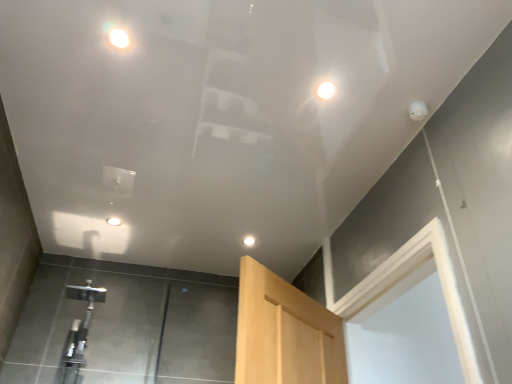
Question: Is matte white droplight at upper center, the 4th droplight positioned from the back, further to the viewer compared to white glossy droplight at upper center, the fourth droplight viewed from the right?

Choices:
 (A) no
 (B) yes

Answer: (A)

Question: Does matte white droplight at upper center, arranged as the 3th droplight when viewed from the right, lie in front of white glossy droplight at upper center, the fourth droplight viewed from the right?

Choices:
 (A) no
 (B) yes

Answer: (B)

Question: Is matte white droplight at upper center, arranged as the first droplight when viewed from the front, not close to white glossy droplight at upper center, which appears as the 2th droplight when viewed from the back?

Choices:
 (A) no
 (B) yes

Answer: (B)

Question: Is matte white droplight at upper center, acting as the second droplight starting from the left, wider than white glossy droplight at upper center, which is the third droplight from front to back?

Choices:
 (A) yes
 (B) no

Answer: (B)

Question: Considering the relative sizes of matte white droplight at upper center, acting as the second droplight starting from the left, and white glossy droplight at upper center, the fourth droplight viewed from the right, in the image provided, is matte white droplight at upper center, acting as the second droplight starting from the left, shorter than white glossy droplight at upper center, the fourth droplight viewed from the right,?

Choices:
 (A) no
 (B) yes

Answer: (A)

Question: In the image, is matte white droplight at upper center, acting as the second droplight starting from the left, positioned in front of or behind white glossy droplight at upper center, arranged as the 1th droplight when viewed from the back?

Choices:
 (A) front
 (B) behind

Answer: (A)

Question: In terms of width, does matte white droplight at upper center, acting as the second droplight starting from the left, look wider or thinner when compared to white glossy droplight at upper center, which is counted as the second droplight, starting from the right?

Choices:
 (A) thin
 (B) wide

Answer: (B)

Question: From a real-world perspective, is matte white droplight at upper center, acting as the second droplight starting from the left, above or below white glossy droplight at upper center, which is the 4th droplight in front-to-back order?

Choices:
 (A) above
 (B) below

Answer: (A)

Question: Would you say matte white droplight at upper center, acting as the second droplight starting from the left, is to the left or to the right of white glossy droplight at upper center, which is the 4th droplight in front-to-back order, in the picture?

Choices:
 (A) left
 (B) right

Answer: (A)

Question: Considering the positions of point [x=114, y=41] and point [x=321, y=89], is point [x=114, y=41] closer or farther from the camera than point [x=321, y=89]?

Choices:
 (A) farther
 (B) closer

Answer: (B)

Question: From the image's perspective, relative to white glossy droplight at upper center, placed as the second droplight when sorted from front to back, is matte white droplight at upper center, acting as the second droplight starting from the left, above or below?

Choices:
 (A) above
 (B) below

Answer: (A)

Question: In the image, is matte white droplight at upper center, acting as the second droplight starting from the left, on the left side or the right side of white glossy droplight at upper center, the first droplight when ordered from right to left?

Choices:
 (A) right
 (B) left

Answer: (B)

Question: Considering the positions of matte white droplight at upper center, the 4th droplight positioned from the back, and white glossy droplight at upper center, the first droplight when ordered from right to left, in the image, is matte white droplight at upper center, the 4th droplight positioned from the back, wider or thinner than white glossy droplight at upper center, the first droplight when ordered from right to left,?

Choices:
 (A) thin
 (B) wide

Answer: (A)

Question: Is white glossy droplight at upper center, the fourth droplight viewed from the left, bigger or smaller than white glossy droplight at upper center, the 1th droplight when ordered from left to right?

Choices:
 (A) small
 (B) big

Answer: (A)

Question: Is white glossy droplight at upper center, the third droplight in the bottom-to-top sequence, spatially inside white glossy droplight at upper center, the fourth droplight viewed from the right, or outside of it?

Choices:
 (A) outside
 (B) inside

Answer: (A)